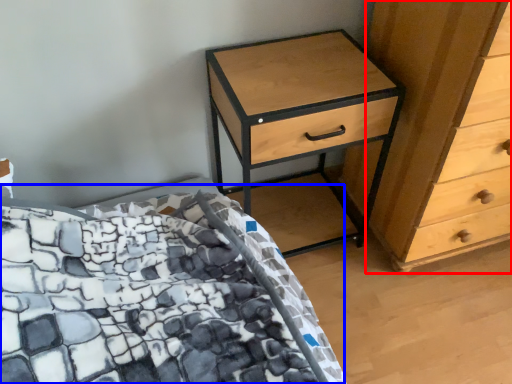
Question: Which of the following is the closest to the observer, chest of drawers (highlighted by a red box) or bed (highlighted by a blue box)?

Choices:
 (A) chest of drawers
 (B) bed

Answer: (A)